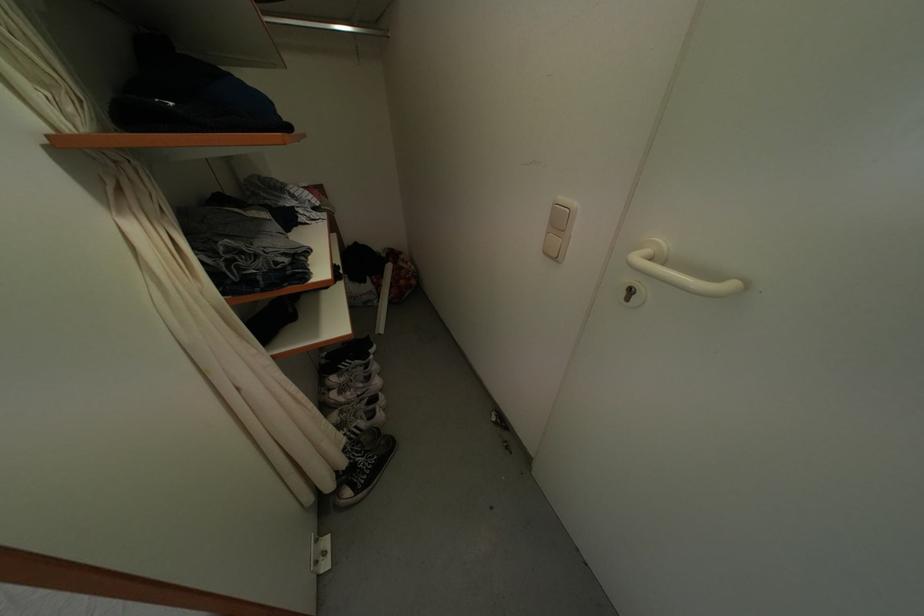
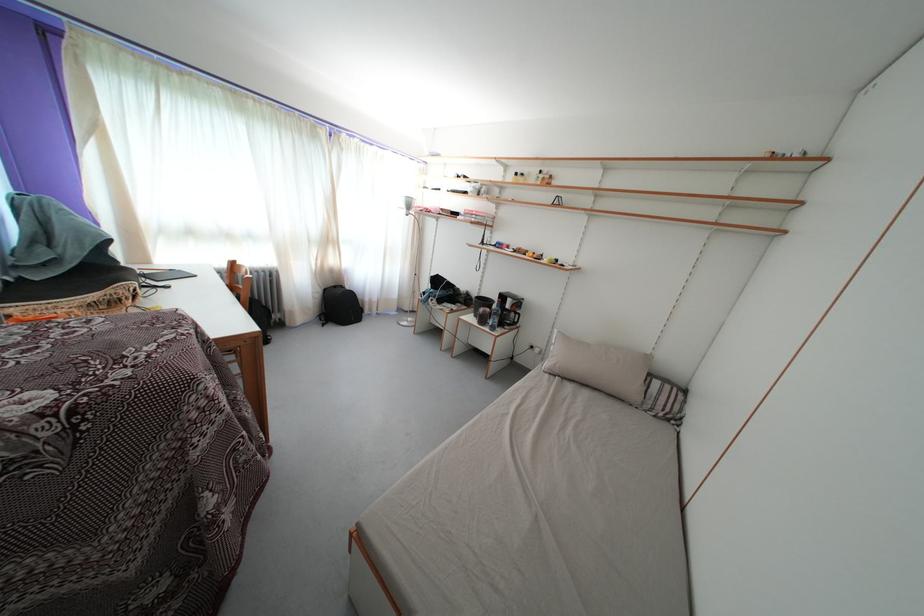
Question: The camera is either moving clockwise (left) or counter-clockwise (right) around the object. The first image is from the beginning of the video and the second image is from the end. Is the camera moving left or right when shooting the video?

Choices:
 (A) Left
 (B) Right

Answer: (B)